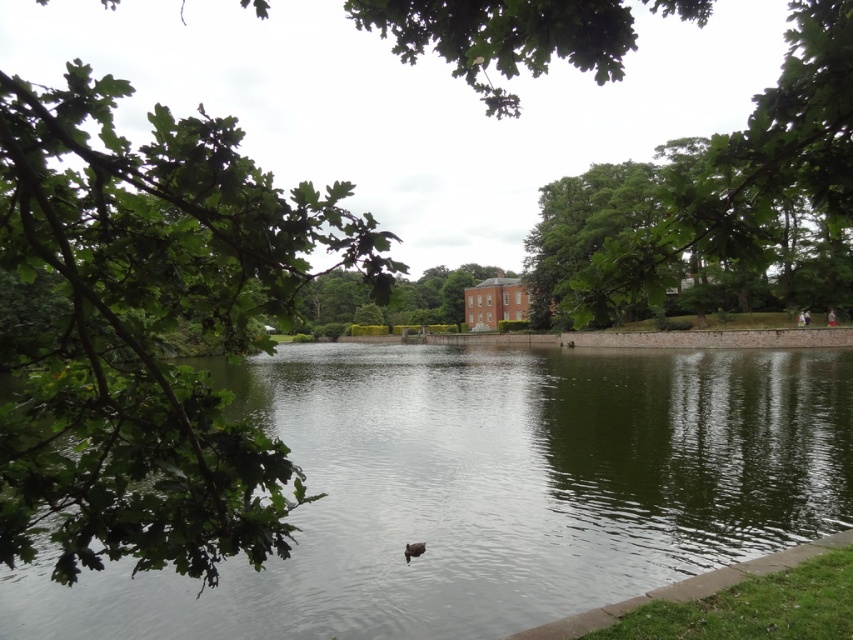
Based on the photo, you are standing at the lakeside and notice the green reflective water at center and the brown fuzzy duck at center. Which object is positioned higher in the image?

The green reflective water at center is above the brown fuzzy duck at center, so the green reflective water at center is positioned higher in the image.

You are standing at the lakeside and want to take a photo of both point (113, 99) and point (648, 228). Which point should you focus on first to ensure both are in clear view?

Since point (113, 99) is closer to the camera than point (648, 228), you should focus on point (113, 99) first to ensure both are in clear view.

You are standing at the lakeside and want to compare the widths of the green reflective water at center and the green leafy tree at center. Which one appears wider from your current position?

The green reflective water at center appears wider than the green leafy tree at center based on the description provided.